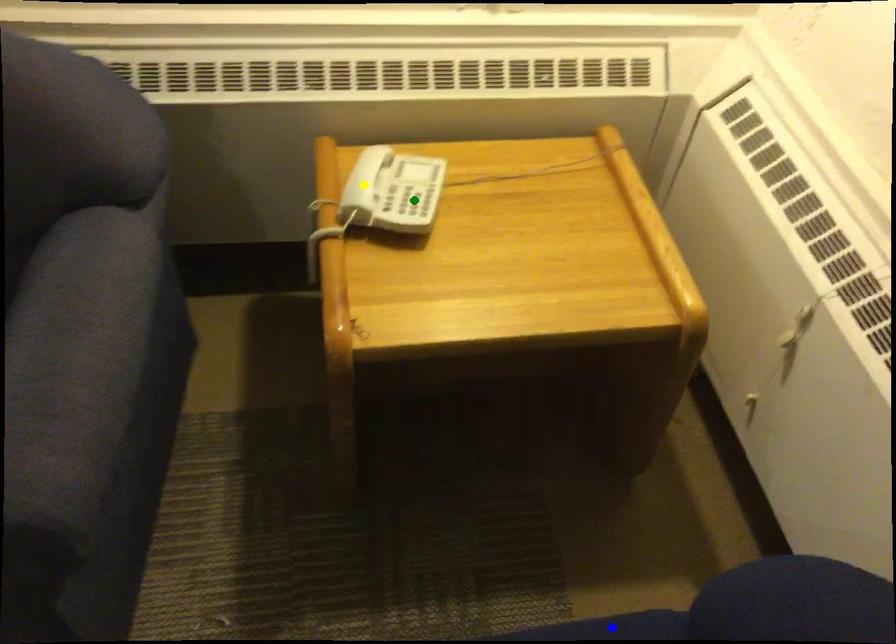
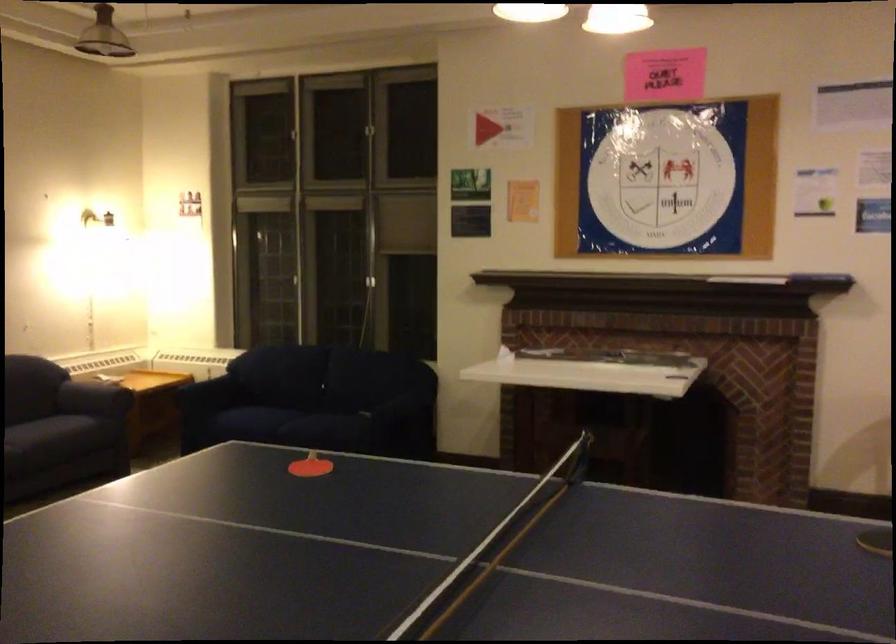
I am providing you with two images of the same scene from different viewpoints. Three points are marked in image1. Which point corresponds to a part or object that is occluded in image2?In image1, three points are marked. Which of them correspond to a part or object that is occluded in image2?Among the three points shown in image1, which one corresponds to a part or object that is no longer visible due to occlusion in image2?

Invisible in image2: yellow point, blue point, green point.